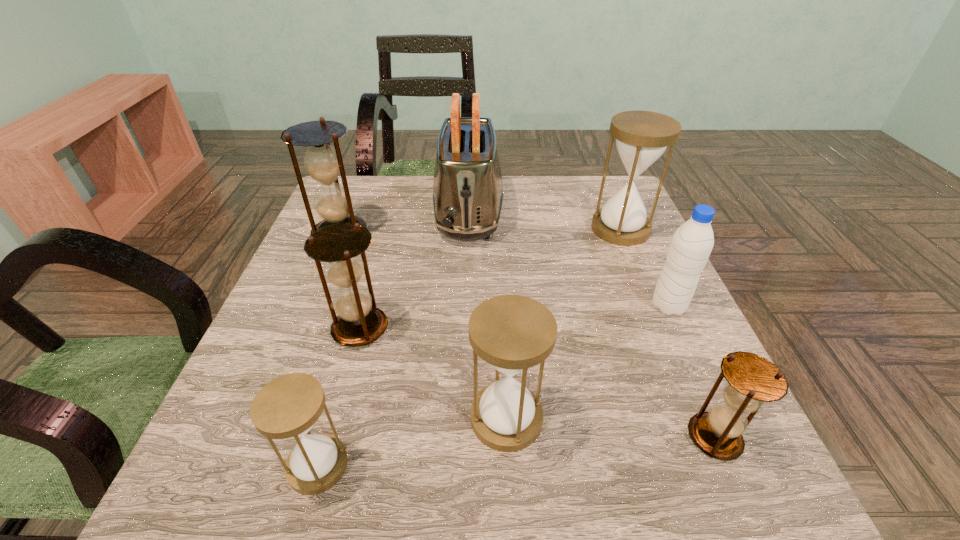
Where is `object identified as the fifth closest to the biggest brown hourglass`? Image resolution: width=960 pixels, height=540 pixels. object identified as the fifth closest to the biggest brown hourglass is located at coordinates (642, 137).

Identify the location of hourglass that is the second closest one to the gray toaster. (359, 322).

At what (x,y) coordinates should I click in order to perform the action: click on hourglass that is the fifth nearest to the biggest brown hourglass. Please return your answer as a coordinate pair (x, y). The width and height of the screenshot is (960, 540). Looking at the image, I should click on (752, 380).

Find the location of a particular element. Image resolution: width=960 pixels, height=540 pixels. the second closest white hourglass to the second white hourglass from left to right is located at coordinates (642, 137).

Identify which white hourglass is the closest to the rightmost white hourglass. Please provide its 2D coordinates. Your answer should be formatted as a tuple, i.e. [(x, y)], where the tuple contains the x and y coordinates of a point satisfying the conditions above.

[(513, 333)]

Locate an element on the screen. the closest brown hourglass to the smallest brown hourglass is located at coordinates (359, 322).

At what (x,y) coordinates should I click in order to perform the action: click on brown hourglass that is the second closest to the rightmost white hourglass. Please return your answer as a coordinate pair (x, y). Image resolution: width=960 pixels, height=540 pixels. Looking at the image, I should click on (359, 322).

Locate an element on the screen. Image resolution: width=960 pixels, height=540 pixels. free space that satisfies the following two spatial constraints: 1. on the side of the gray toaster with the control lever; 2. on the left side of the rightmost white hourglass is located at coordinates (468, 229).

Locate an element on the screen. The image size is (960, 540). free location that satisfies the following two spatial constraints: 1. on the front side of the nearest brown hourglass; 2. on the left side of the second white hourglass from right to left is located at coordinates (507, 437).

Locate an element on the screen. This screenshot has height=540, width=960. free space that satisfies the following two spatial constraints: 1. on the back side of the water bottle; 2. on the right side of the rightmost brown hourglass is located at coordinates (658, 306).